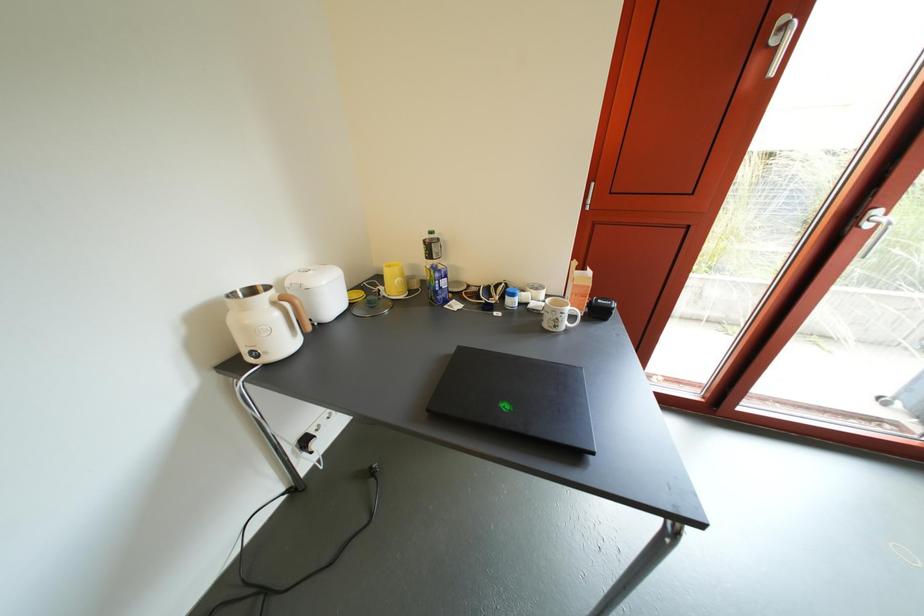
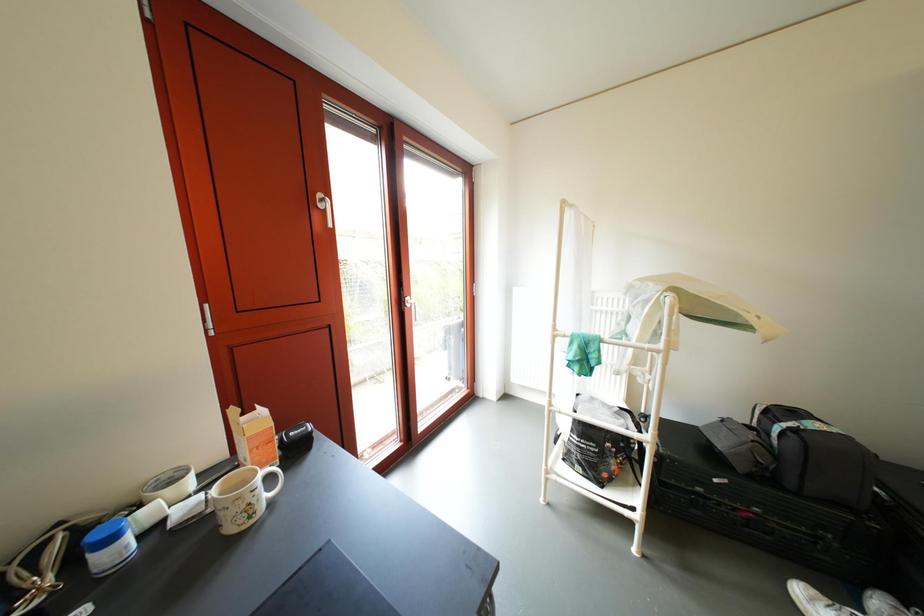
Question: The camera is either moving clockwise (left) or counter-clockwise (right) around the object. The first image is from the beginning of the video and the second image is from the end. Is the camera moving left or right when shooting the video?

Choices:
 (A) Left
 (B) Right

Answer: (A)